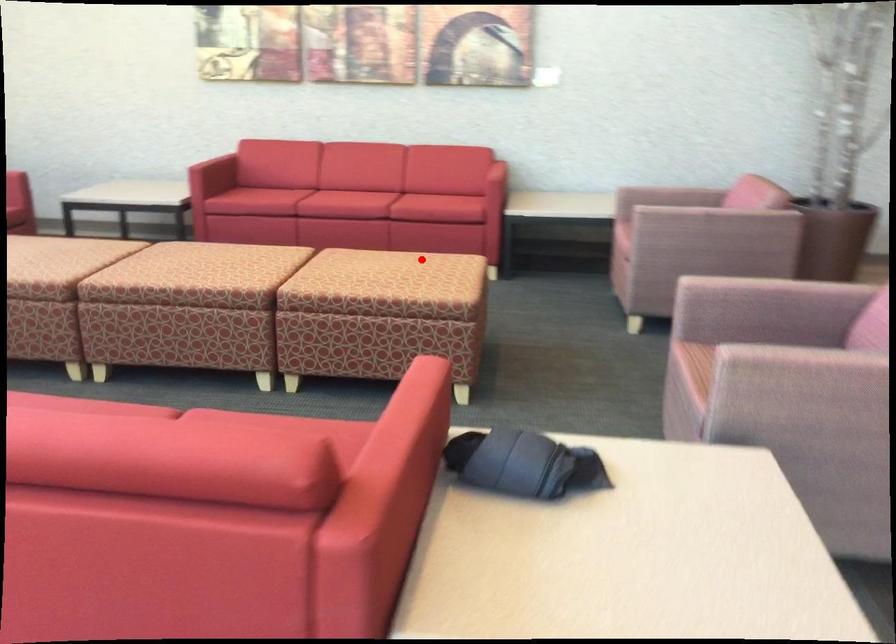
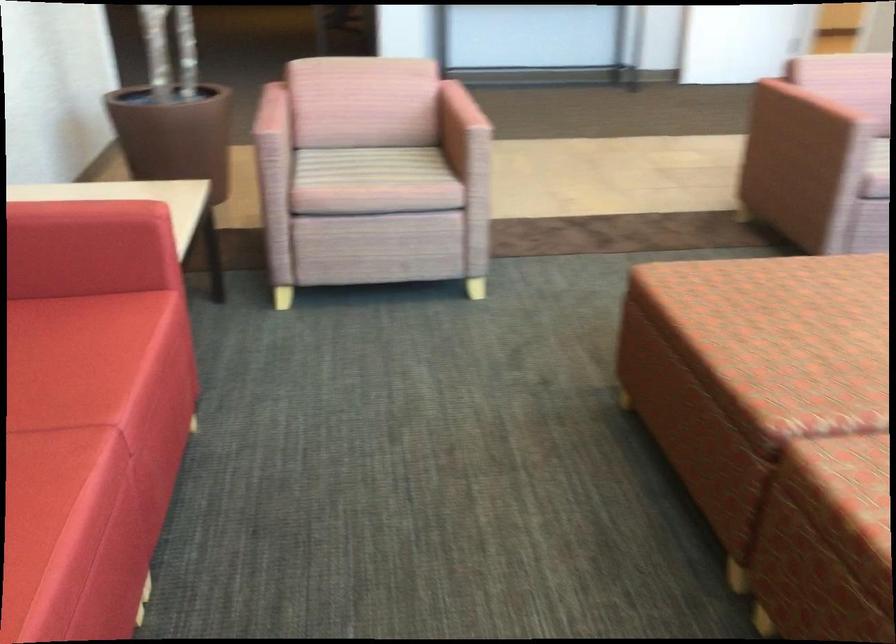
Find the pixel in the second image that matches the highlighted location in the first image.

(805, 304)